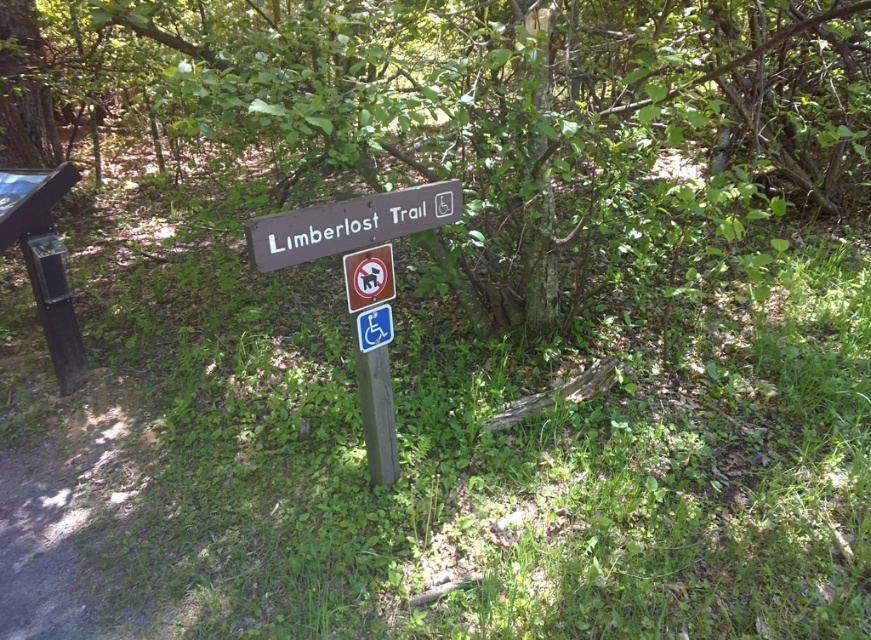
Can you confirm if metallic rectangular sign at center is thinner than blue plastic handicap sign at center?

Incorrect, metallic rectangular sign at center's width is not less than blue plastic handicap sign at center's.

Is metallic rectangular sign at center behind blue plastic handicap sign at center?

No, metallic rectangular sign at center is closer to the viewer.

This screenshot has height=640, width=871. In order to click on metallic rectangular sign at center in this screenshot , I will do [368, 276].

Which of these two, brown wood sign at center or blue plastic handicap sign at center, stands shorter?

blue plastic handicap sign at center is shorter.

Between brown wood sign at center and blue plastic handicap sign at center, which one is positioned higher?

brown wood sign at center is higher up.

Image resolution: width=871 pixels, height=640 pixels. In order to click on brown wood sign at center in this screenshot , I will do pyautogui.click(x=349, y=225).

Locate an element on the screen. This screenshot has height=640, width=871. brown wood sign at center is located at coordinates (349, 225).

Does brown wood tree at center have a smaller size compared to metallic rectangular sign at center?

Incorrect, brown wood tree at center is not smaller in size than metallic rectangular sign at center.

Between brown wood tree at center and metallic rectangular sign at center, which one has less height?

With less height is metallic rectangular sign at center.

Describe the element at coordinates (477, 104) in the screenshot. I see `brown wood tree at center` at that location.

This screenshot has width=871, height=640. I want to click on brown wood tree at center, so click(477, 104).